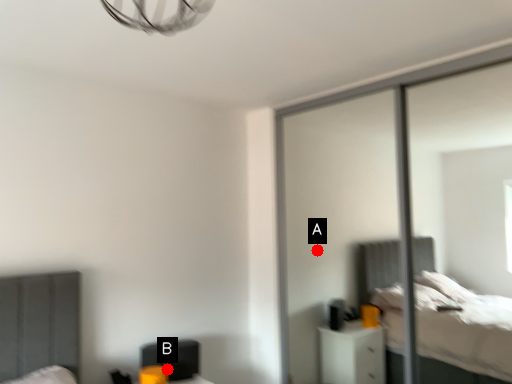
Question: Two points are circled on the image, labeled by A and B beside each circle. Which point is farther from the camera taking this photo?

Choices:
 (A) A is further
 (B) B is further

Answer: (A)